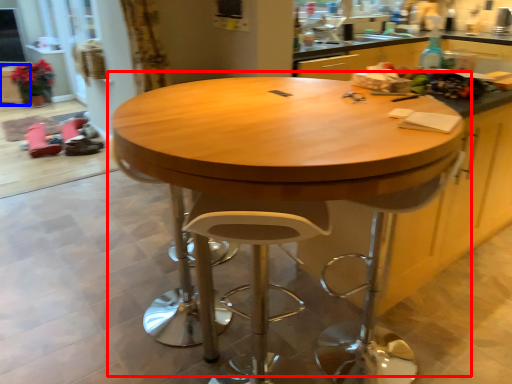
Question: Which object appears closest to the camera in this image, table (highlighted by a red box) or cabinetry (highlighted by a blue box)?

Choices:
 (A) table
 (B) cabinetry

Answer: (A)